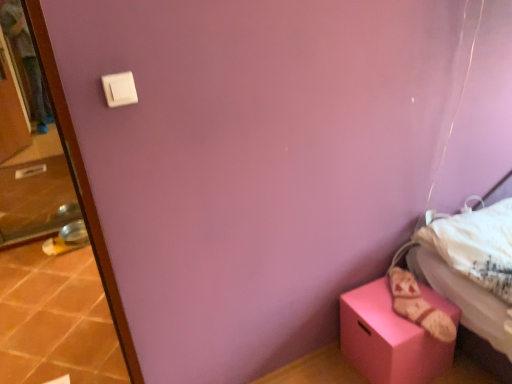
Question: Is white plastic light switch at upper left facing towards terracotta tile at lower left?

Choices:
 (A) yes
 (B) no

Answer: (B)

Question: Does white plastic light switch at upper left appear on the left side of terracotta tile at lower left?

Choices:
 (A) yes
 (B) no

Answer: (B)

Question: Can you confirm if white plastic light switch at upper left is wider than terracotta tile at lower left?

Choices:
 (A) no
 (B) yes

Answer: (A)

Question: From a real-world perspective, is white plastic light switch at upper left positioned under terracotta tile at lower left based on gravity?

Choices:
 (A) no
 (B) yes

Answer: (A)

Question: Is white plastic light switch at upper left bigger than terracotta tile at lower left?

Choices:
 (A) no
 (B) yes

Answer: (A)

Question: Is white plastic light switch at upper left inside or outside of terracotta tile at lower left?

Choices:
 (A) outside
 (B) inside

Answer: (A)

Question: From the image's perspective, relative to terracotta tile at lower left, is white plastic light switch at upper left above or below?

Choices:
 (A) below
 (B) above

Answer: (B)

Question: From a real-world perspective, is white plastic light switch at upper left physically located above or below terracotta tile at lower left?

Choices:
 (A) below
 (B) above

Answer: (B)

Question: Looking at the image, does white plastic light switch at upper left seem bigger or smaller compared to terracotta tile at lower left?

Choices:
 (A) small
 (B) big

Answer: (A)

Question: In the image, is matte pink box at lower right positioned in front of or behind transparent glass screen door at left?

Choices:
 (A) front
 (B) behind

Answer: (A)

Question: Looking at their shapes, would you say matte pink box at lower right is wider or thinner than transparent glass screen door at left?

Choices:
 (A) thin
 (B) wide

Answer: (B)

Question: From the image's perspective, is matte pink box at lower right located above or below transparent glass screen door at left?

Choices:
 (A) below
 (B) above

Answer: (A)

Question: Is point (409, 370) positioned closer to the camera than point (5, 218)?

Choices:
 (A) farther
 (B) closer

Answer: (B)

Question: Choose the correct answer: Is transparent glass screen door at left inside white plastic light switch at upper left or outside it?

Choices:
 (A) inside
 (B) outside

Answer: (B)

Question: Is transparent glass screen door at left wider or thinner than white plastic light switch at upper left?

Choices:
 (A) wide
 (B) thin

Answer: (A)